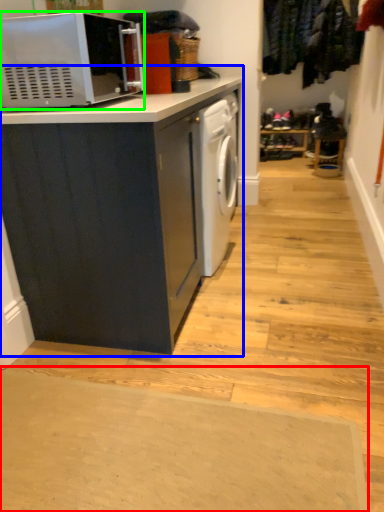
Question: Considering the real-world distances, which object is farthest from doormat (highlighted by a red box)? cabinetry (highlighted by a blue box) or microwave oven (highlighted by a green box)?

Choices:
 (A) cabinetry
 (B) microwave oven

Answer: (B)